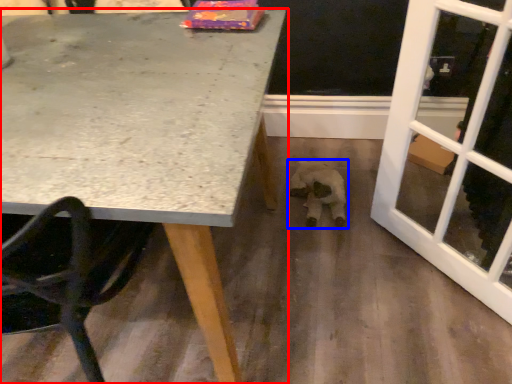
Question: Among these objects, which one is farthest to the camera, table (highlighted by a red box) or animal (highlighted by a blue box)?

Choices:
 (A) table
 (B) animal

Answer: (B)